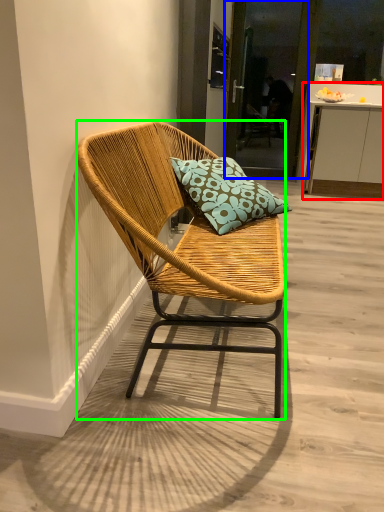
Question: Based on their relative distances, which object is farther from cabinetry (highlighted by a red box)? Choose from screen door (highlighted by a blue box) and chair (highlighted by a green box).

Choices:
 (A) screen door
 (B) chair

Answer: (B)